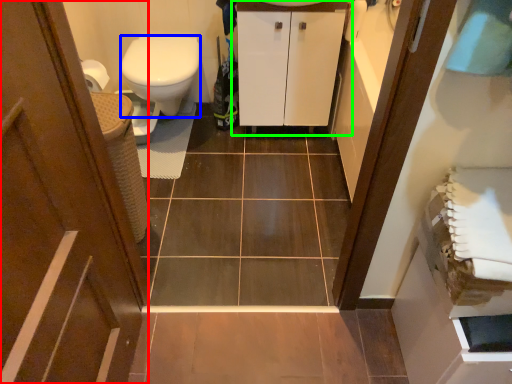
Question: Which object is the closest to the door (highlighted by a red box)? Choose among these: bidet (highlighted by a blue box) or bathroom cabinet (highlighted by a green box).

Choices:
 (A) bidet
 (B) bathroom cabinet

Answer: (A)